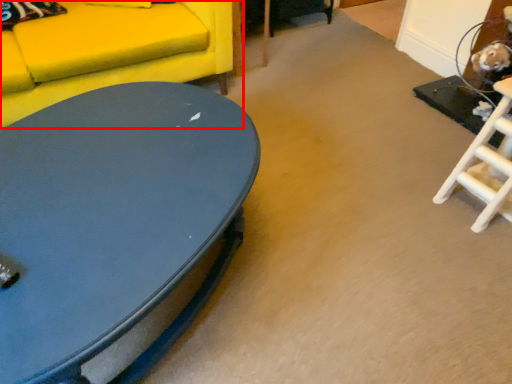
Question: Observing the image, what is the correct spatial positioning of studio couch (annotated by the red box) in reference to coffee table?

Choices:
 (A) left
 (B) right

Answer: (A)